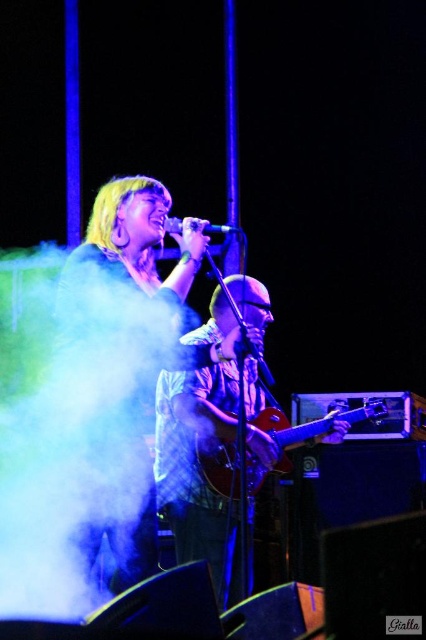
Based on the photo, you are a photographer at the back of the venue. You want to take a clear photo of the black matte microphone at center without any obstructions. Is the white fog at center blocking your view of the microphone?

The white fog at center is in front of the black matte microphone at center, so it is blocking the view of the microphone. To capture a clear photo, you would need to wait until the fog clears or adjust your angle to avoid the obstruction.

You are a stagehand who needs to move a 36 inch long equipment case from the side of the stage to the back. The path between white fog at center and glossy wood guitar at center is 34.03 inches. Can you safely move the equipment case through this path without it getting stuck?

The distance between the white fog at center and the glossy wood guitar at center is 34.03 inches. Since the equipment case is 36 inches long, it is slightly longer than the available space. Therefore, the equipment case cannot pass through the path between the white fog at center and the glossy wood guitar at center without getting stuck.